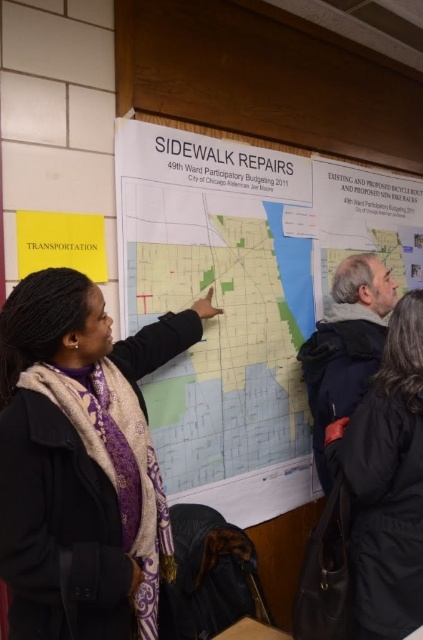
Question: Which object appears closest to the camera in this image?

Choices:
 (A) matte black scarf at center
 (B) white paper map at center

Answer: (A)

Question: Does matte black scarf at center come behind light blue paper map at center?

Choices:
 (A) yes
 (B) no

Answer: (B)

Question: Is white paper map at center thinner than black wool coat at lower right?

Choices:
 (A) no
 (B) yes

Answer: (A)

Question: Which point is closer to the camera?

Choices:
 (A) (2, 316)
 (B) (390, 580)

Answer: (A)

Question: Is matte black scarf at center closer to camera compared to black wool coat at lower right?

Choices:
 (A) yes
 (B) no

Answer: (A)

Question: Which is nearer to the light blue paper map at center?

Choices:
 (A) white paper map at center
 (B) black wool coat at lower right

Answer: (A)